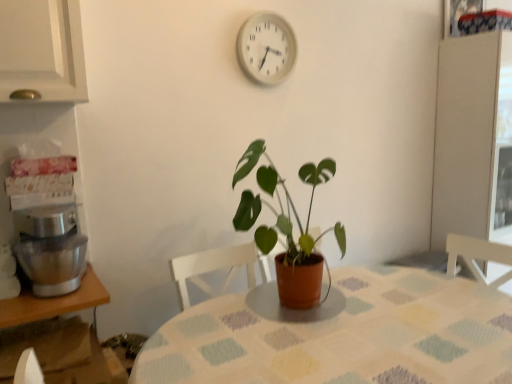
Image resolution: width=512 pixels, height=384 pixels. Find the location of `free space on the front side of green matte plant at center`. free space on the front side of green matte plant at center is located at coordinates (312, 345).